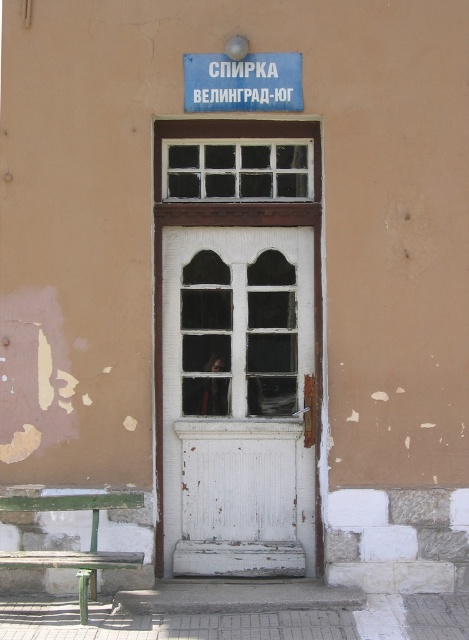
You are standing in front of the building and want to enter. Which object, the white wooden door at center or the white wooden window at center, should you approach to go inside?

You should approach the white wooden door at center because it is closer to the viewer than the white wooden window at center, making it the entrance.

You are a delivery person trying to deliver a package to the address shown in the image. The package is too large to fit through the door. Can you determine if the blue painted metal sign at upper center is taller than the white wooden door at center based on the information provided?

The white wooden door at center is much taller than the blue painted metal sign at upper center, so the sign is not taller than the door. Therefore, the package cannot be passed through the door, and the sign height comparison does not help with the delivery issue.

You are a delivery driver who needs to deliver a package to the address located at the white wooden door at center. You see the blue painted metal sign at upper center above the door. Which object is more to the left?

The white wooden door at center is positioned on the left side of blue painted metal sign at upper center, so the white wooden door at center is more to the left.